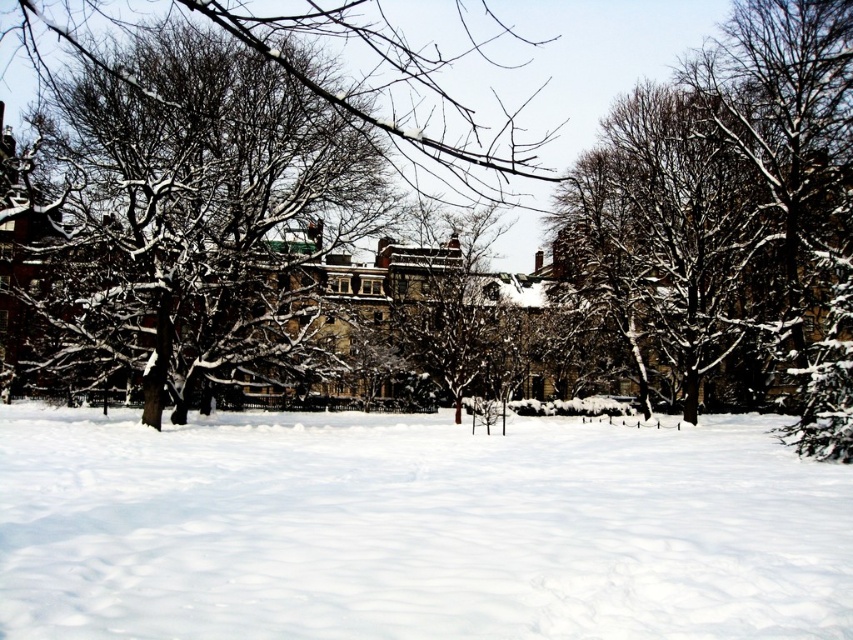
Can you confirm if white fluffy snow at center is wider than snow-covered tree at left?

Yes, white fluffy snow at center is wider than snow-covered tree at left.

Can you confirm if white fluffy snow at center is positioned below snow-covered tree at left?

Yes, white fluffy snow at center is below snow-covered tree at left.

Between point (698, 484) and point (347, 129), which one is positioned in front?

Point (698, 484) is more forward.

The width and height of the screenshot is (853, 640). I want to click on white fluffy snow at center, so click(415, 529).

Can you confirm if snow-covered tree at left is bigger than snow-covered tree at center?

Indeed, snow-covered tree at left has a larger size compared to snow-covered tree at center.

I want to click on snow-covered tree at left, so click(198, 211).

Which is behind, point (276, 285) or point (492, 292)?

Positioned behind is point (492, 292).

The image size is (853, 640). In order to click on snow-covered tree at left in this screenshot , I will do `click(198, 211)`.

In the scene shown: Can you confirm if white fluffy snow at center is positioned to the left of snow-covered tree at center?

Indeed, white fluffy snow at center is positioned on the left side of snow-covered tree at center.

Which is above, white fluffy snow at center or snow-covered tree at center?

snow-covered tree at center is above.

Who is more distant from viewer, (778, 500) or (405, 323)?

Positioned behind is point (405, 323).

This screenshot has width=853, height=640. In order to click on white fluffy snow at center in this screenshot , I will do `click(415, 529)`.